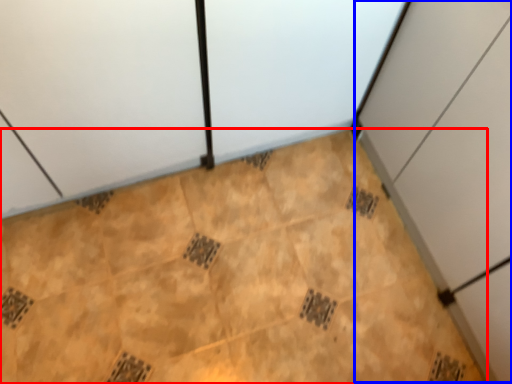
Question: Which point is closer to the camera, ceramic tile (highlighted by a red box) or cabinetry (highlighted by a blue box)?

Choices:
 (A) ceramic tile
 (B) cabinetry

Answer: (B)